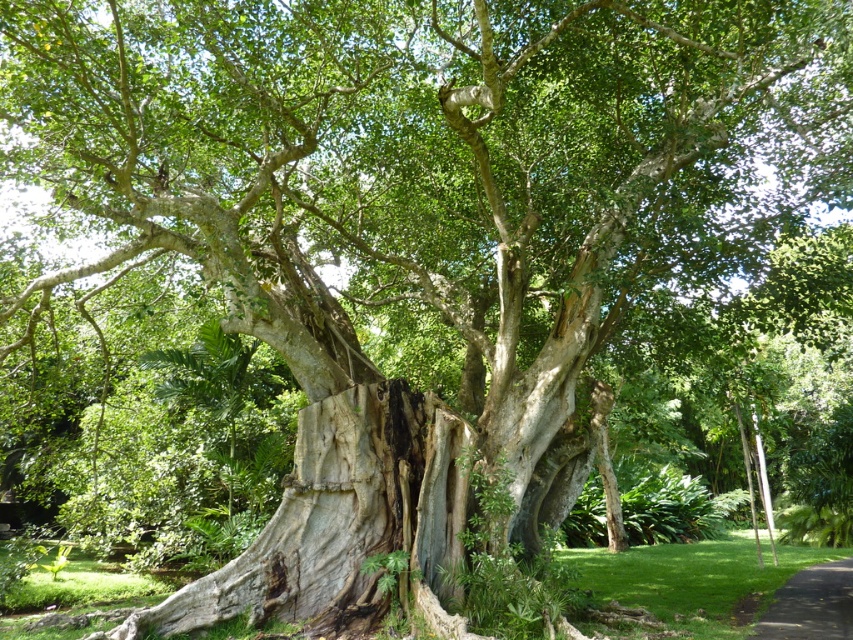
Question: In this image, where is gray rough bark tree trunk at center located relative to black asphalt path at lower right?

Choices:
 (A) above
 (B) below

Answer: (A)

Question: Can you confirm if gray rough bark tree trunk at center is smaller than black asphalt path at lower right?

Choices:
 (A) no
 (B) yes

Answer: (B)

Question: Which of the following is the closest to the observer?

Choices:
 (A) gray rough bark tree trunk at center
 (B) black asphalt path at lower right

Answer: (A)

Question: Which point is closer to the camera taking this photo?

Choices:
 (A) (447, 499)
 (B) (838, 595)

Answer: (A)

Question: Can you confirm if gray rough bark tree trunk at center is wider than black asphalt path at lower right?

Choices:
 (A) no
 (B) yes

Answer: (A)